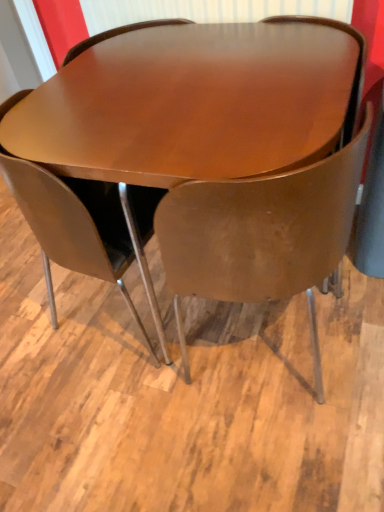
In order to click on free spot to the left of matte brown chair at center, the first chair in the right-to-left sequence in this screenshot , I will do `click(150, 411)`.